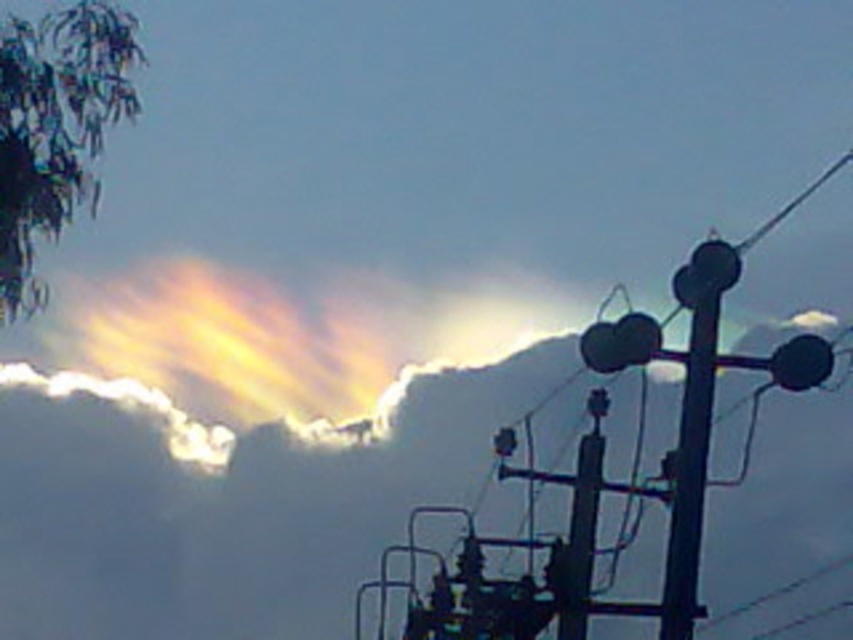
Question: Which of the following is the closest to the observer?

Choices:
 (A) (717, 618)
 (B) (709, 324)

Answer: (B)

Question: Is black metallic pole at center above metallic wire at right?

Choices:
 (A) yes
 (B) no

Answer: (A)

Question: Does black metallic pole at center lie behind metallic wire at right?

Choices:
 (A) no
 (B) yes

Answer: (B)

Question: Is black metallic pole at center above metallic wire at right?

Choices:
 (A) yes
 (B) no

Answer: (A)

Question: Which of the following is the closest to the observer?

Choices:
 (A) metallic wire at right
 (B) black metallic pole at center

Answer: (A)

Question: Which of the following is the farthest from the observer?

Choices:
 (A) (694, 364)
 (B) (735, 611)

Answer: (B)